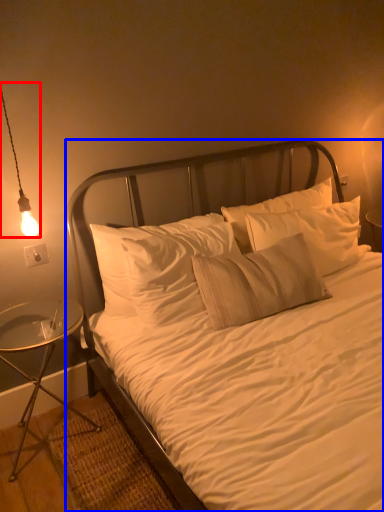
Question: Which of the following is the farthest to the observer, lamp (highlighted by a red box) or bed (highlighted by a blue box)?

Choices:
 (A) lamp
 (B) bed

Answer: (A)